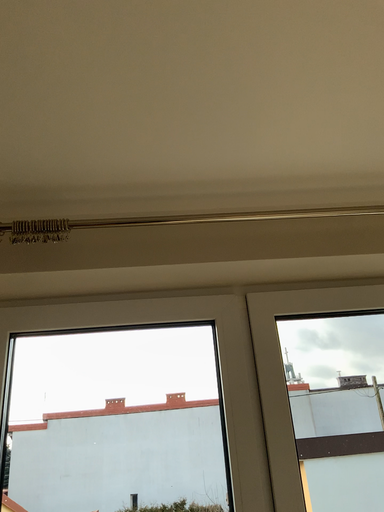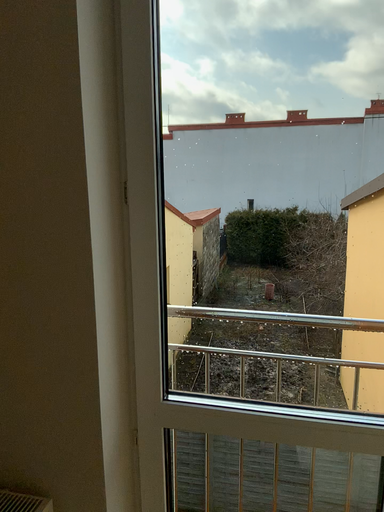
Question: How did the camera likely rotate when shooting the video?

Choices:
 (A) rotated left
 (B) rotated right

Answer: (A)